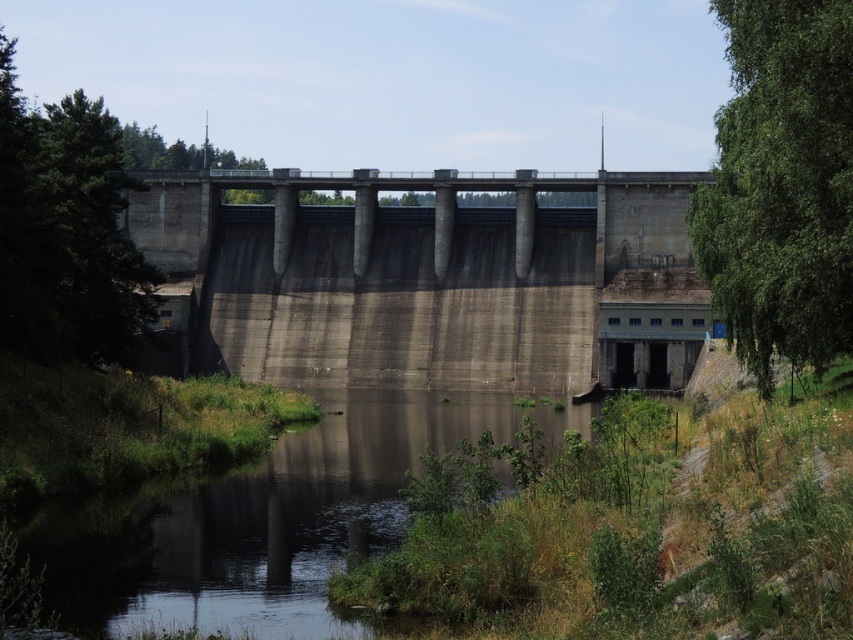
Question: Considering the relative positions of gray concrete dam at center and green leafy tree at right in the image provided, where is gray concrete dam at center located with respect to green leafy tree at right?

Choices:
 (A) left
 (B) right

Answer: (A)

Question: Which of the following is the closest to the observer?

Choices:
 (A) (459, 278)
 (B) (244, 500)

Answer: (B)

Question: Which is farther from the green leafy tree at left?

Choices:
 (A) green grassy river at center
 (B) gray concrete dam at center

Answer: (B)

Question: Observing the image, what is the correct spatial positioning of gray concrete dam at center in reference to green leafy tree at left?

Choices:
 (A) below
 (B) above

Answer: (A)

Question: Is green grassy river at center positioned at the back of green leafy tree at right?

Choices:
 (A) yes
 (B) no

Answer: (B)

Question: Considering the real-world distances, which object is closest to the green grassy river at center?

Choices:
 (A) green leafy tree at left
 (B) gray concrete dam at center
 (C) green leafy tree at right

Answer: (C)